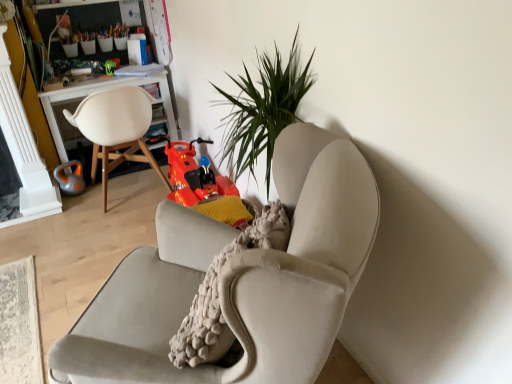
Question: Do you think orange rubber kettlebell at left, acting as the 1th toy starting from the left, is within white wood desk at left, or outside of it?

Choices:
 (A) inside
 (B) outside

Answer: (B)

Question: Is orange rubber kettlebell at left, marked as the second toy in a right-to-left arrangement, bigger or smaller than white wood desk at left?

Choices:
 (A) small
 (B) big

Answer: (A)

Question: Which object is the farthest from the white matte chair at left, which is counted as the 1th chair, starting from the left?

Choices:
 (A) shiny green toy at upper left, placed as the second toy when sorted from bottom to top
 (B) white wood desk at left
 (C) velvet beige armchair at center, the 1th chair viewed from the right
 (D) orange rubber kettlebell at left, acting as the 1th toy starting from the left

Answer: (C)

Question: Estimate the real-world distances between objects in this image. Which object is farther from the orange rubber kettlebell at left, marked as the second toy in a right-to-left arrangement?

Choices:
 (A) velvet beige armchair at center, the second chair from the left
 (B) shiny green toy at upper left, which is the 2th toy in left-to-right order
 (C) white matte chair at left, placed as the 2th chair when sorted from right to left
 (D) white wood desk at left

Answer: (A)